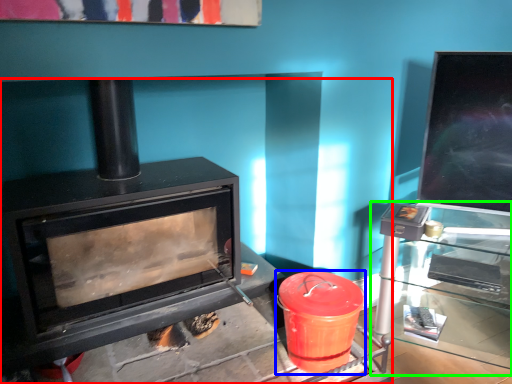
Question: Based on their relative distances, which object is nearer to wood burning stove (highlighted by a red box)? Choose from crock pot (highlighted by a blue box) and table (highlighted by a green box).

Choices:
 (A) crock pot
 (B) table

Answer: (A)